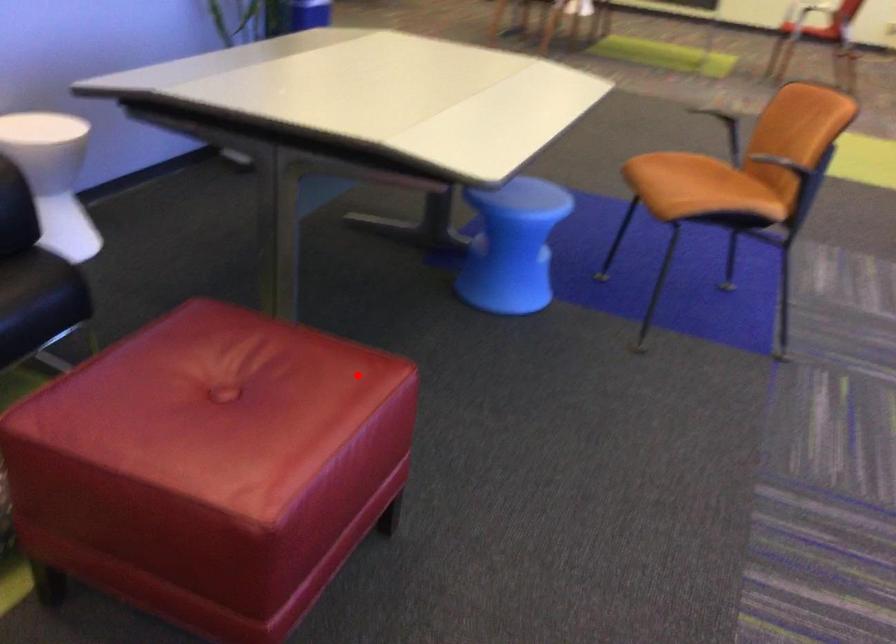
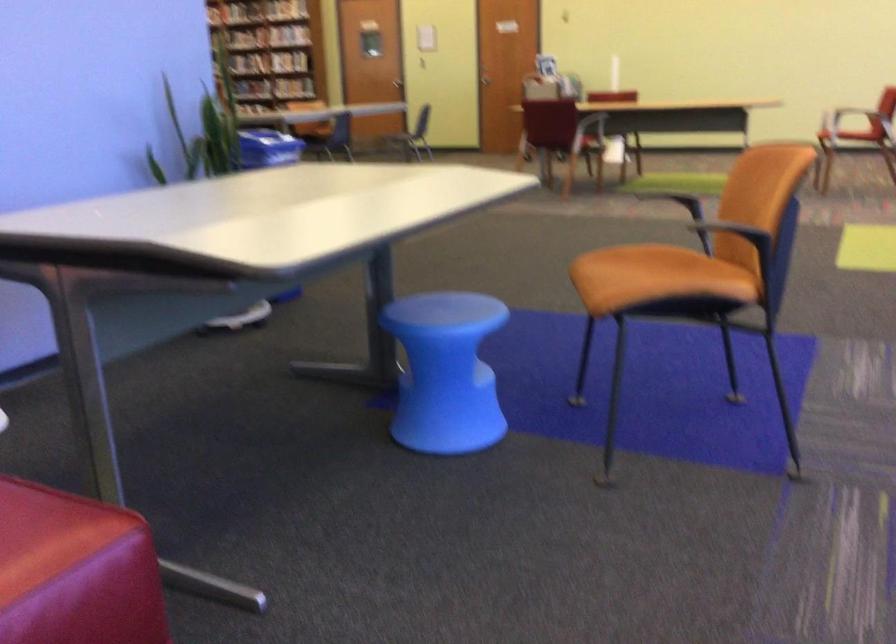
Question: I am providing you with two images of the same scene from different viewpoints. Given a red point in image1, look at the same physical point in image2. Is it:

Choices:
 (A) Closer to the viewpoint
 (B) Farther from the viewpoint

Answer: (A)